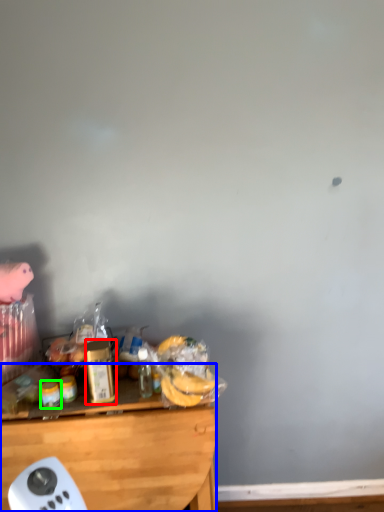
Question: Estimate the real-world distances between objects in this image. Which object is farther from bottle (highlighted by a red box), desk (highlighted by a blue box) or food (highlighted by a green box)?

Choices:
 (A) desk
 (B) food

Answer: (A)